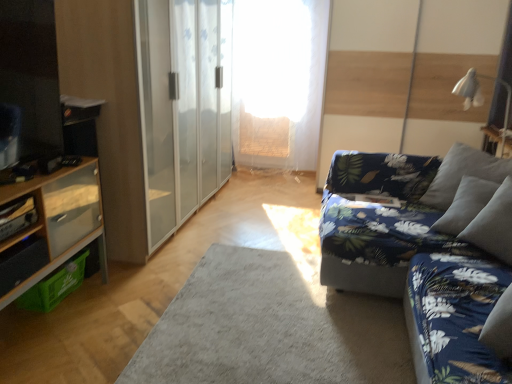
What do you see at coordinates (278, 81) in the screenshot? The image size is (512, 384). I see `transparent fabric at center` at bounding box center [278, 81].

What do you see at coordinates (182, 108) in the screenshot?
I see `transparent glass barn door at center` at bounding box center [182, 108].

The image size is (512, 384). Describe the element at coordinates (271, 327) in the screenshot. I see `gray soft rug at center` at that location.

Describe the element at coordinates (419, 253) in the screenshot. This screenshot has height=384, width=512. I see `blue floral fabric couch at right` at that location.

Image resolution: width=512 pixels, height=384 pixels. Describe the element at coordinates (481, 96) in the screenshot. I see `white fabric lampshade at upper right` at that location.

You are a GUI agent. You are given a task and a screenshot of the screen. Output one action in this format:
    pyautogui.click(x=<x>, y=<y>)
    Task: Click on the transparent fabric at center
    This screenshot has height=384, width=512.
    Given the screenshot: What is the action you would take?
    pyautogui.click(x=278, y=81)

Does white fabric lampshade at upper right have a lesser width compared to gray soft rug at center?

Yes, white fabric lampshade at upper right is thinner than gray soft rug at center.

The height and width of the screenshot is (384, 512). Find the location of `plain directly beneath the white fabric lampshade at upper right (from a real-world perspective)`. plain directly beneath the white fabric lampshade at upper right (from a real-world perspective) is located at coordinates (271, 327).

Between white fabric lampshade at upper right and gray soft rug at center, which one has more height?

With more height is white fabric lampshade at upper right.

Does blue floral fabric couch at right lie behind wooden cabinet at left?

Yes, blue floral fabric couch at right is further from the viewer.

Is blue floral fabric couch at right aimed at wooden cabinet at left?

No, blue floral fabric couch at right is not oriented towards wooden cabinet at left.

Find the location of a particular element. cabinetry in front of the blue floral fabric couch at right is located at coordinates (58, 219).

Which of these two, blue floral fabric couch at right or wooden cabinet at left, is thinner?

wooden cabinet at left is thinner.

Which is more to the left, gray soft rug at center or white fabric lampshade at upper right?

gray soft rug at center is more to the left.

Which of these two, gray soft rug at center or white fabric lampshade at upper right, stands shorter?

gray soft rug at center is shorter.

Is gray soft rug at center wider than white fabric lampshade at upper right?

Yes.

Which is more to the left, wooden cabinet at left or blue floral fabric couch at right?

From the viewer's perspective, wooden cabinet at left appears more on the left side.

Which of these two, wooden cabinet at left or blue floral fabric couch at right, is smaller?

Smaller between the two is wooden cabinet at left.

I want to click on plain located underneath the wooden cabinet at left (from a real-world perspective), so (x=271, y=327).

Would you consider gray soft rug at center to be distant from wooden cabinet at left?

They are positioned close to each other.

Does gray soft rug at center have a larger size compared to wooden cabinet at left?

Incorrect, gray soft rug at center is not larger than wooden cabinet at left.

Between gray soft rug at center and wooden cabinet at left, which one appears on the left side from the viewer's perspective?

From the viewer's perspective, wooden cabinet at left appears more on the left side.

Relative to transparent glass barn door at center, is wooden shelf at left in front or behind?

wooden shelf at left is in front of transparent glass barn door at center.

What's the angular difference between wooden shelf at left and transparent glass barn door at center's facing directions?

0.138 degrees.

Can you confirm if wooden shelf at left is shorter than transparent glass barn door at center?

Yes, wooden shelf at left is shorter than transparent glass barn door at center.

Based on the photo, is wooden shelf at left positioned far away from transparent glass barn door at center?

Yes, wooden shelf at left is far from transparent glass barn door at center.

Consider the image. Is gray soft rug at center taller than transparent fabric at center?

In fact, gray soft rug at center may be shorter than transparent fabric at center.

Which is more to the right, gray soft rug at center or transparent fabric at center?

Positioned to the right is transparent fabric at center.

Considering the sizes of gray soft rug at center and transparent fabric at center in the image, is gray soft rug at center bigger or smaller than transparent fabric at center?

Considering their sizes, gray soft rug at center takes up less space than transparent fabric at center.

Based on the photo, which is correct: gray soft rug at center is inside transparent fabric at center, or outside of it?

gray soft rug at center is not inside transparent fabric at center, it's outside.

Identify the location of plain located in front of the white fabric lampshade at upper right. pyautogui.click(x=271, y=327).

Identify the location of studio couch that is behind the wooden cabinet at left. (419, 253).

Estimate the real-world distances between objects in this image. Which object is closer to gray soft rug at center, wooden cabinet at left or blue floral fabric couch at right?

blue floral fabric couch at right.

Which object lies nearer to the anchor point wooden cabinet at left, blue floral fabric couch at right or transparent glass barn door at center?

Among the two, transparent glass barn door at center is located nearer to wooden cabinet at left.

From the image, which object appears to be nearer to transparent glass barn door at center, gray soft rug at center or wooden cabinet at left?

Among the two, wooden cabinet at left is located nearer to transparent glass barn door at center.

In the scene shown: Based on their spatial positions, is wooden cabinet at left or blue floral fabric couch at right further from transparent fabric at center?

wooden cabinet at left is positioned further to the anchor transparent fabric at center.

Based on their spatial positions, is wooden shelf at left or white fabric lampshade at upper right further from wooden cabinet at left?

white fabric lampshade at upper right is further to wooden cabinet at left.

Estimate the real-world distances between objects in this image. Which object is further from transparent fabric at center, gray soft rug at center or transparent glass barn door at center?

gray soft rug at center.

Looking at the image, which one is located further to transparent fabric at center, wooden cabinet at left or gray soft rug at center?

The object further to transparent fabric at center is wooden cabinet at left.

Looking at the image, which one is located further to transparent fabric at center, wooden shelf at left or wooden cabinet at left?

The object further to transparent fabric at center is wooden shelf at left.

Locate an element on the screen. Image resolution: width=512 pixels, height=384 pixels. barn door between blue floral fabric couch at right and transparent fabric at center from front to back is located at coordinates (182, 108).

This screenshot has width=512, height=384. Find the location of `plain between wooden shelf at left and blue floral fabric couch at right from left to right`. plain between wooden shelf at left and blue floral fabric couch at right from left to right is located at coordinates (271, 327).

Find the location of a particular element. Image resolution: width=512 pixels, height=384 pixels. studio couch located between transparent glass barn door at center and white fabric lampshade at upper right in the left-right direction is located at coordinates (419, 253).

Find the location of a particular element. The height and width of the screenshot is (384, 512). barn door situated between wooden shelf at left and blue floral fabric couch at right from left to right is located at coordinates (182, 108).